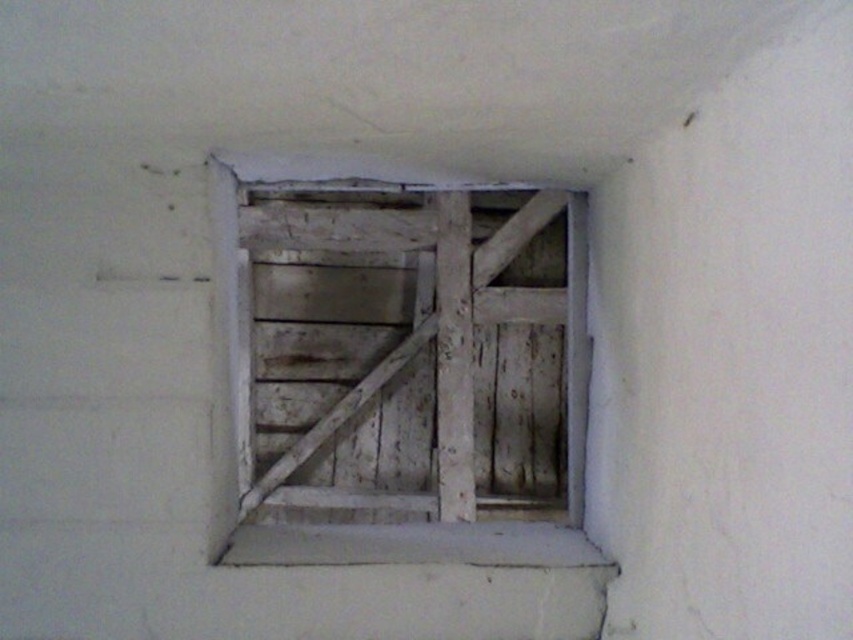
You are an interior designer planning to install a new fixture that requires mounting above the white wood window sill at center. The weathered wood door at center is currently in that location. Can the fixture be installed there without moving the door?

The weathered wood door at center is positioned over the white wood window sill at center, so the fixture cannot be installed there without moving the door.

You are an interior designer planning to install a new decorative element between the weathered wood window frame at center and the white wood window sill at center. Which object should you attach the element to if you want it to be more prominent?

The weathered wood window frame at center is larger in size than the white wood window sill at center, so attaching the decorative element to the weathered wood window frame at center would make it more prominent.

You are standing in a room and see a weathered wood door at center. You need to reach it to exit. Your height is 1.7 meters. Can you comfortably reach the doorknob without needing a stool?

The distance between you and the weathered wood door at center is 3.19 meters. Since the doorknob is typically placed at about 1 meter height from the ground, and your height is 1.7 meters, you can comfortably reach it without needing a stool.